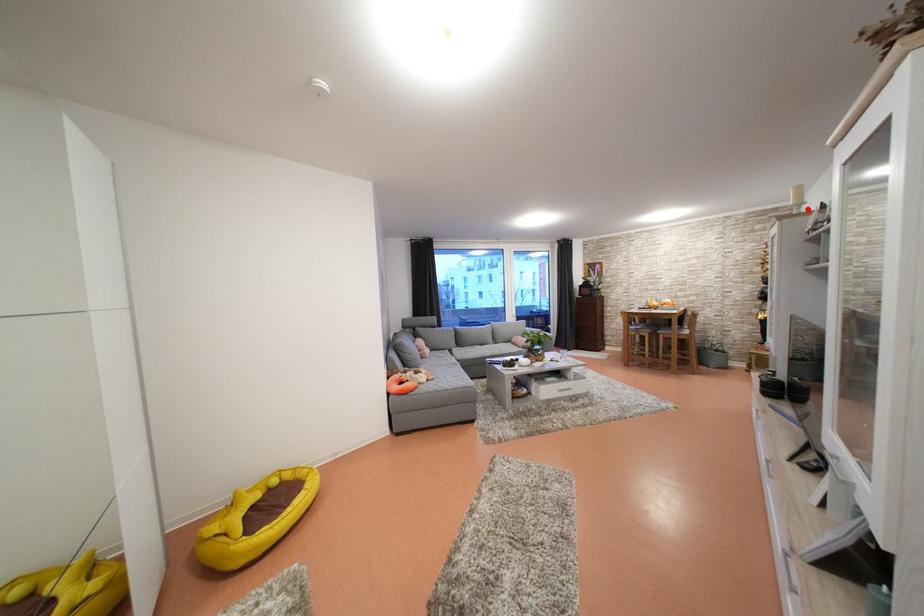
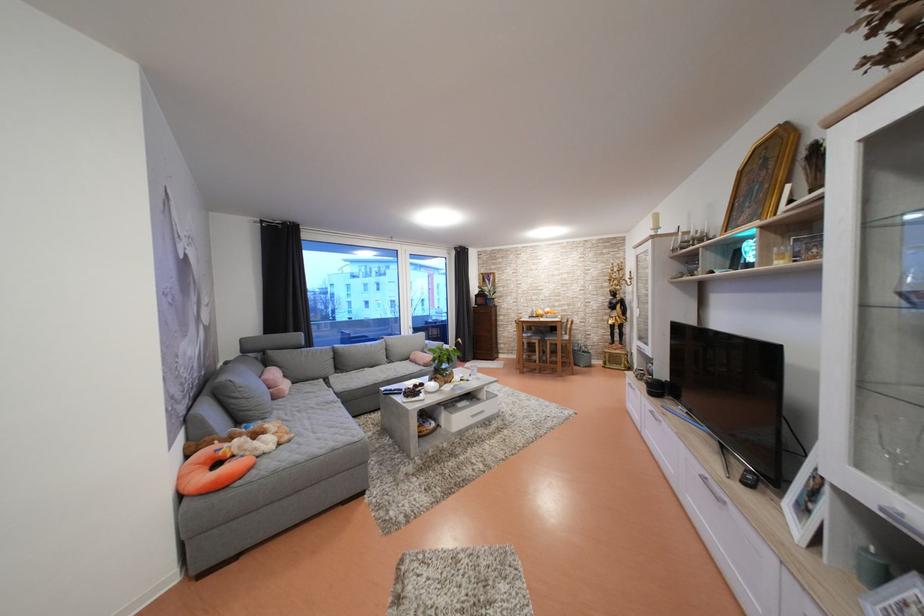
Locate, in the second image, the point that corresponds to the highlighted location in the first image.

(664, 233)